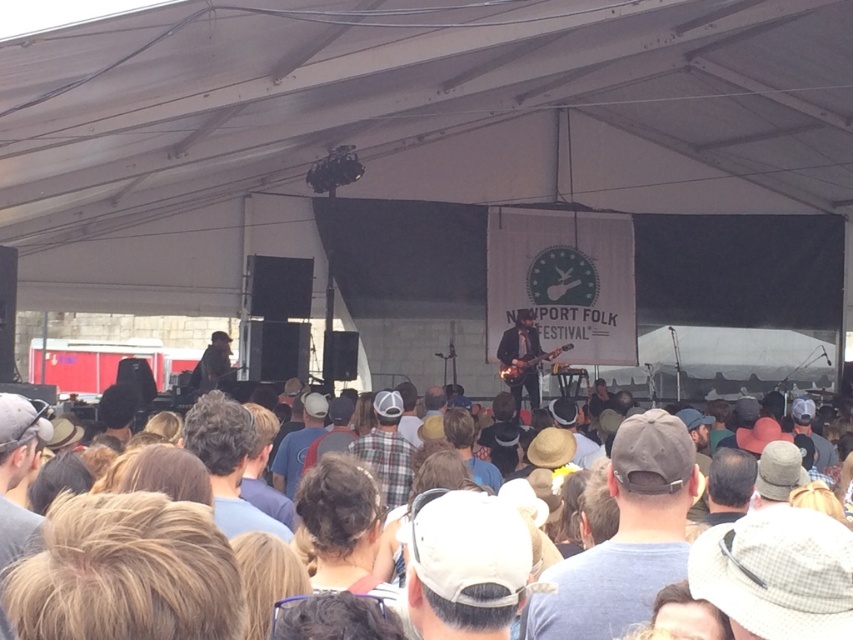
You are standing at the center of the outdoor concert stage. There are two points marked on the stage floor. One is at point coordinate point (637, 566) and the other is at point coordinate point (245, 524). Which point is closer to you?

Point (637, 566) is closer to the viewer than point (245, 524), so the point at coordinate point (637, 566) is closer to you.

You are a photographer positioned at the camera. You want to capture a closeup shot of the gray fabric cap at center. Given that your camera can focus on subjects within 3 meters, will you need to move closer or farther away to achieve this?

The gray fabric cap at center is 3.40 meters away from the camera. Since the camera can focus within 3 meters, you need to move closer to the gray fabric cap at center to get a closeup shot.

You are a photographer standing at the front of the stage during the Newport Folk Festival. You want to take a photo of the performer with both the dark brown hair at center and the plaid shirt at center in the frame. Given that your camera has a maximum focus range of 10 feet, will you be able to capture both objects in focus without moving closer?

The distance between the dark brown hair at center and the plaid shirt at center is 12.10 feet. Since the camera can only focus within 10 feet, the objects are too far apart for both to be in focus simultaneously. You would need to adjust your position or use a different camera setting to ensure both are within the focus range.